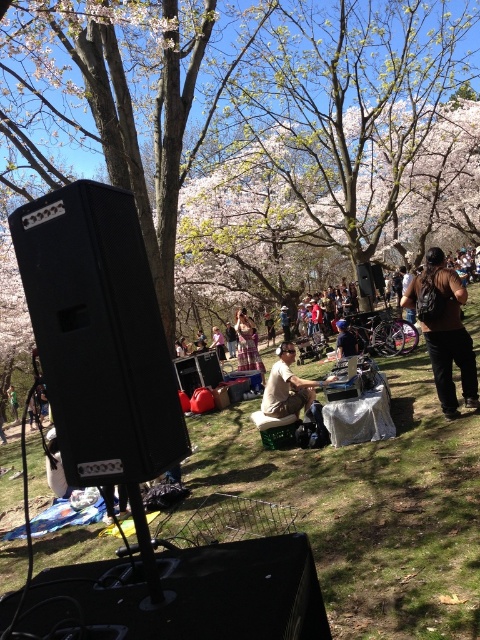
You are planning to set up a picnic blanket in the park shown in the image. The black matte speaker at left is currently in the lower left corner. To avoid blocking the speaker, where should you place your picnic blanket relative to the speaker?

The black matte speaker at left is located at point (98, 333). To avoid blocking it, place your picnic blanket away from this coordinate, ensuring it doesn not obstruct the speaker.

You are standing at the center of the park and want to locate the dark brown leather jacket at lower right. Based on the coordinates provided, is the point at (444, 330) on the dark brown leather jacket at lower right?

Result: Yes, the point at (444, 330) is on the dark brown leather jacket at lower right as stated in the description.

You are standing in the park and want to place a 4 feet long banner between the large black speaker mounted on a stand in the lower left corner and the point at coordinates point (71, 252). Will the banner fit between them?

The distance between the large black speaker mounted on a stand in the lower left corner and point (71, 252) is 3.75 feet. Since the banner is 4 feet long, it will not fit between them as the distance is shorter than the banner.